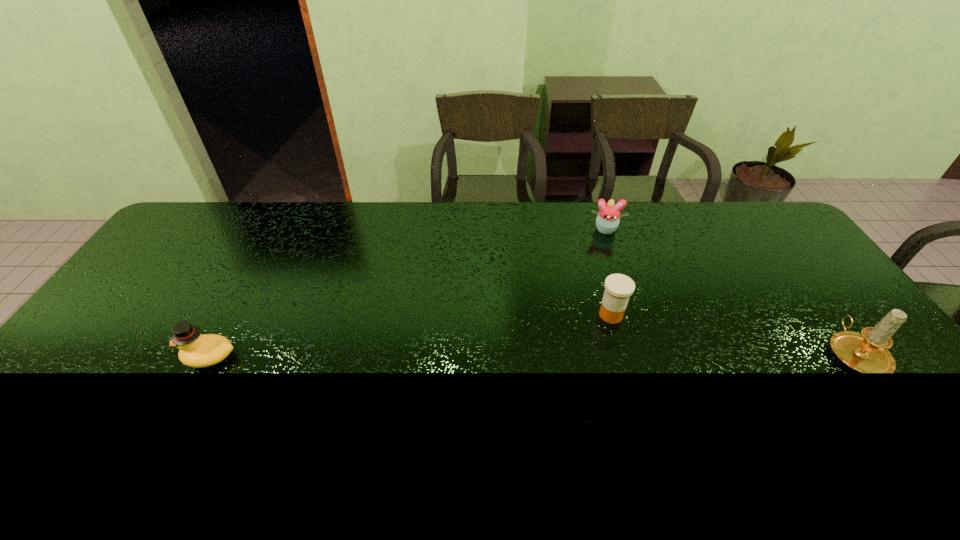
Image resolution: width=960 pixels, height=540 pixels. Identify the location of vacant spot on the desktop that is between the duck and the candle and is positioned on the label of the medicine. (560, 355).

The height and width of the screenshot is (540, 960). What are the coordinates of `vacant spot on the desktop that is between the leftmost object and the rightmost object and is positioned on the face of the cupcake` in the screenshot? It's located at (615, 354).